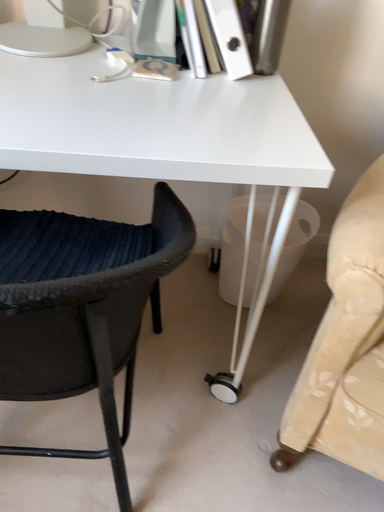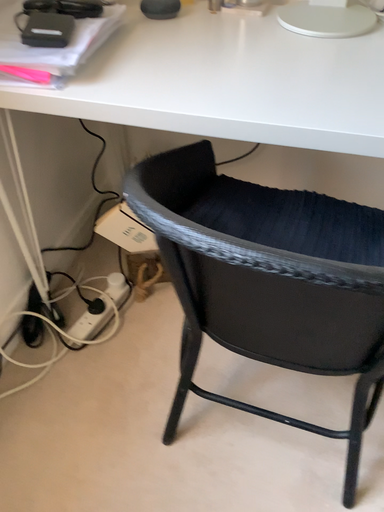
Question: How did the camera likely rotate when shooting the video?

Choices:
 (A) rotated left
 (B) rotated right

Answer: (A)